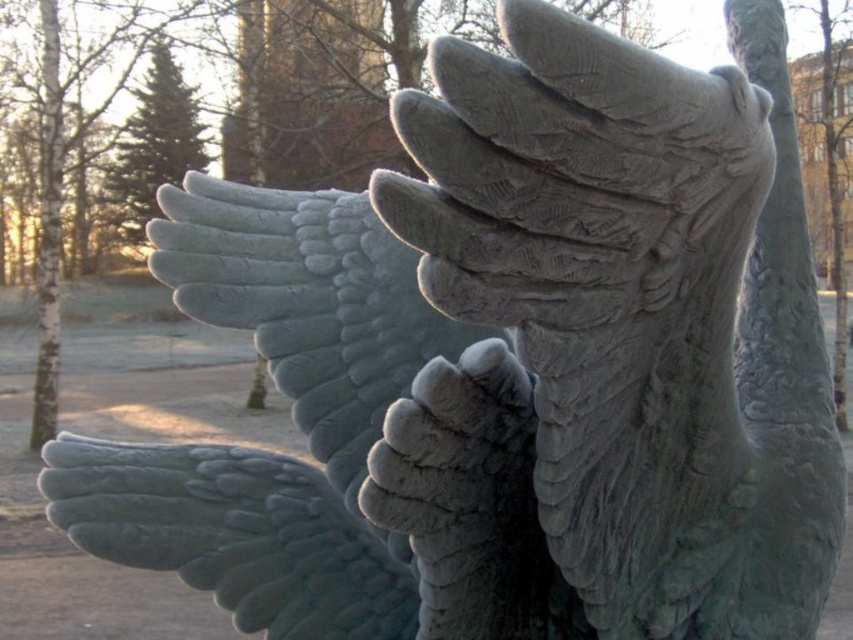
Question: Does bronze textured hand at upper center appear on the right side of green stone wing at lower left?

Choices:
 (A) no
 (B) yes

Answer: (B)

Question: Which of the following is the closest to the observer?

Choices:
 (A) green stone wing at lower left
 (B) bronze textured hand at upper center

Answer: (B)

Question: Is bronze textured hand at upper center above green stone wing at lower left?

Choices:
 (A) yes
 (B) no

Answer: (A)

Question: Can you confirm if bronze textured hand at upper center is wider than green stone wing at lower left?

Choices:
 (A) yes
 (B) no

Answer: (B)

Question: Which object appears closest to the camera in this image?

Choices:
 (A) bronze textured hand at upper center
 (B) green stone wing at lower left

Answer: (A)

Question: Which of the following is the closest to the observer?

Choices:
 (A) bronze textured hand at upper center
 (B) green stone wing at lower left

Answer: (A)